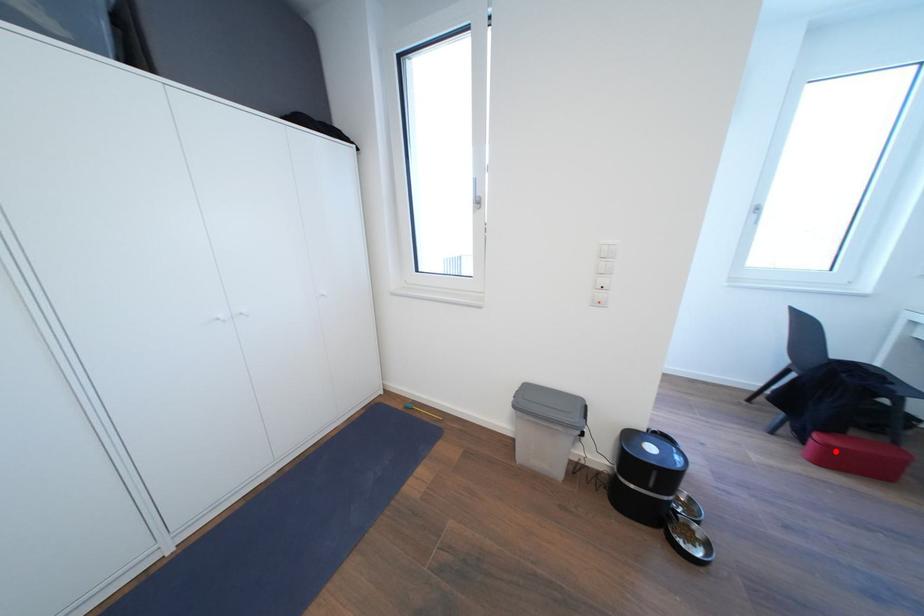
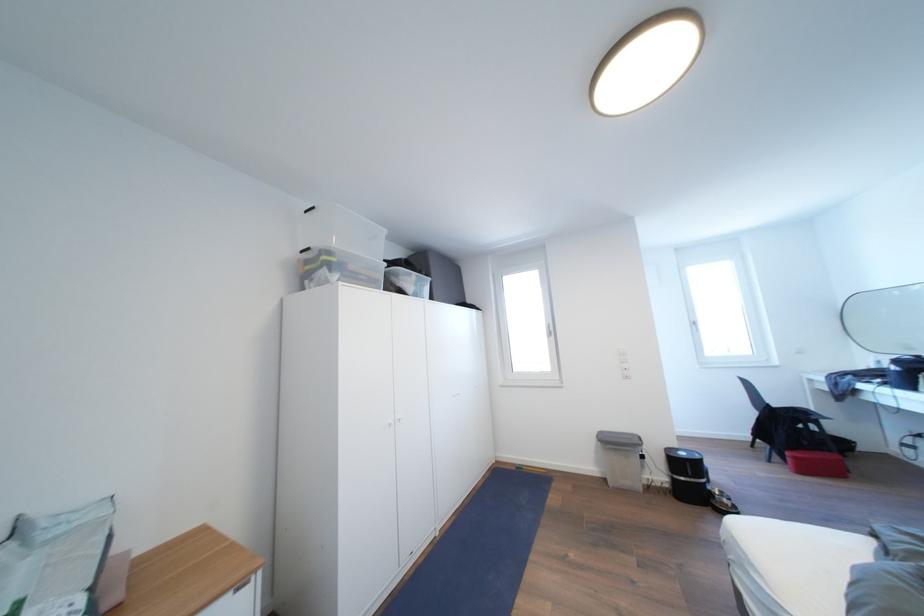
Question: I am providing you with two images of the same scene from different viewpoints. Image1 has a red point marked. In image2, the corresponding 3D location appears at what relative position? Reply with the corresponding letter.

Choices:
 (A) Closer
 (B) Farther

Answer: (B)